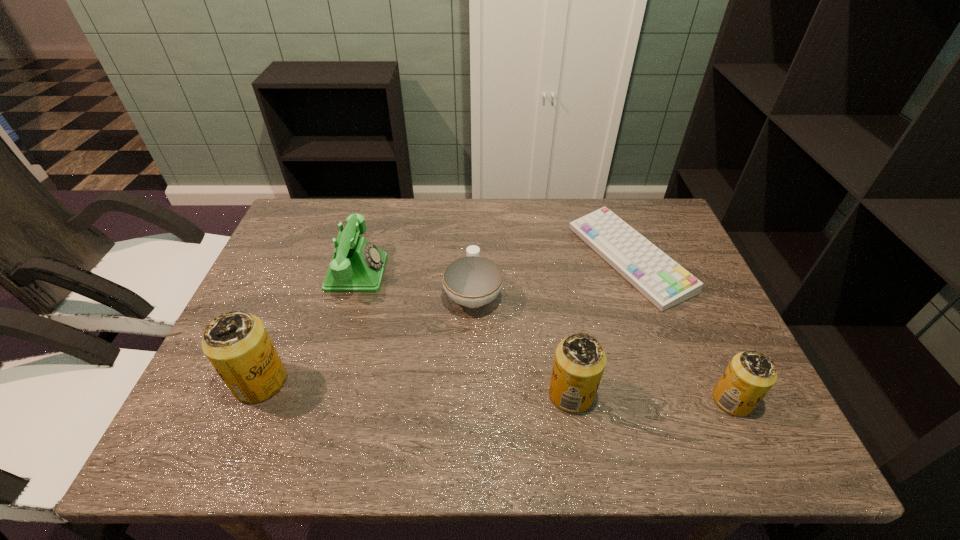
The width and height of the screenshot is (960, 540). I want to click on the leftmost object, so click(x=237, y=344).

The height and width of the screenshot is (540, 960). Identify the location of the second tallest beer can. [x=579, y=363].

You are a GUI agent. You are given a task and a screenshot of the screen. Output one action in this format:
    pyautogui.click(x=<x>, y=<y>)
    Task: Click on the fourth object from left to right
    Image resolution: width=960 pixels, height=540 pixels.
    Given the screenshot: What is the action you would take?
    pyautogui.click(x=579, y=363)

This screenshot has width=960, height=540. I want to click on the shortest beer can, so click(749, 376).

Locate an element on the screen. This screenshot has width=960, height=540. computer keyboard is located at coordinates (665, 283).

Locate an element on the screen. telephone is located at coordinates (357, 266).

Find the location of a particular element. This screenshot has width=960, height=540. the fourth object from right to left is located at coordinates (472, 281).

Find the location of a particular element. This screenshot has height=540, width=960. the second shortest object is located at coordinates (472, 281).

Identify the location of vacant space located on the right of the leftmost object. (469, 382).

Locate an element on the screen. The image size is (960, 540). blank space located 0.080m on the right of the fourth object from left to right is located at coordinates (632, 394).